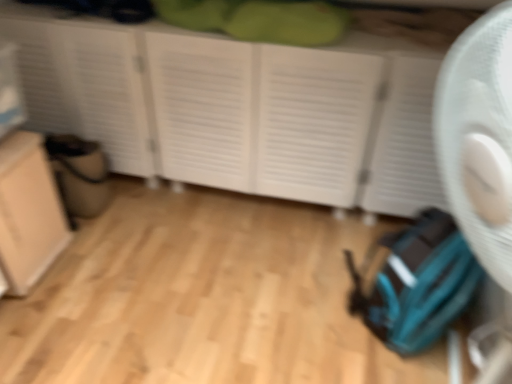
Locate an element on the screen. The height and width of the screenshot is (384, 512). vacant space in front of beige matte cabinet at lower left is located at coordinates (38, 322).